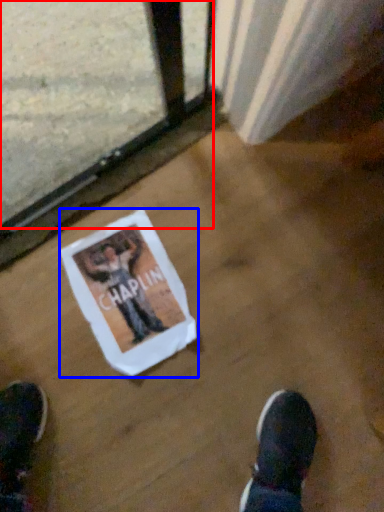
Question: Which of the following is the closest to the observer, train window (highlighted by a red box) or flyer (highlighted by a blue box)?

Choices:
 (A) train window
 (B) flyer

Answer: (A)